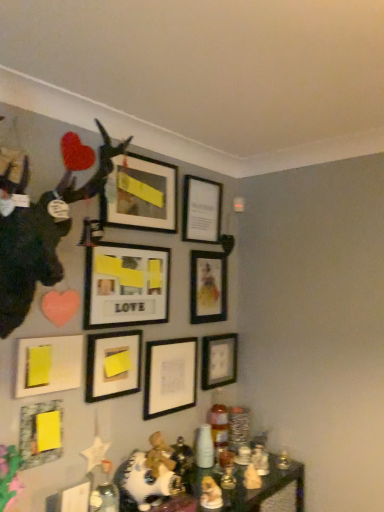
Question: From the image's perspective, would you say yellow matte picture frame at lower left, the first picture frame positioned from the bottom, is shown under matte black picture frame at lower right, positioned as the seventh picture frame in top-to-bottom order?

Choices:
 (A) yes
 (B) no

Answer: (A)

Question: Does yellow matte picture frame at lower left, which ranks as the 9th picture frame in top-to-bottom order, have a lesser width compared to matte black picture frame at lower right, positioned as the seventh picture frame in top-to-bottom order?

Choices:
 (A) yes
 (B) no

Answer: (A)

Question: Is yellow matte picture frame at lower left, which ranks as the 9th picture frame in top-to-bottom order, positioned in front of matte black picture frame at lower right, placed as the 3th picture frame when sorted from bottom to top?

Choices:
 (A) yes
 (B) no

Answer: (A)

Question: From a real-world perspective, is yellow matte picture frame at lower left, which ranks as the 9th picture frame in top-to-bottom order, positioned under matte black picture frame at lower right, placed as the 3th picture frame when sorted from bottom to top, based on gravity?

Choices:
 (A) yes
 (B) no

Answer: (A)

Question: From a real-world perspective, does yellow matte picture frame at lower left, the first picture frame positioned from the bottom, stand above matte black picture frame at lower right, positioned as the seventh picture frame in top-to-bottom order?

Choices:
 (A) yes
 (B) no

Answer: (B)

Question: From a real-world perspective, is matte black picture frame at center, which appears as the eighth picture frame when viewed from the top, above or below shiny glass table at lower center?

Choices:
 (A) below
 (B) above

Answer: (B)

Question: From the image's perspective, is matte black picture frame at center, which is the 2th picture frame from bottom to top, positioned above or below shiny glass table at lower center?

Choices:
 (A) above
 (B) below

Answer: (A)

Question: Do you think matte black picture frame at center, which appears as the eighth picture frame when viewed from the top, is within shiny glass table at lower center, or outside of it?

Choices:
 (A) inside
 (B) outside

Answer: (B)

Question: In the image, is matte black picture frame at center, which appears as the eighth picture frame when viewed from the top, positioned in front of or behind shiny glass table at lower center?

Choices:
 (A) front
 (B) behind

Answer: (B)

Question: Considering the positions of point (208, 309) and point (216, 360), is point (208, 309) closer or farther from the camera than point (216, 360)?

Choices:
 (A) closer
 (B) farther

Answer: (A)

Question: From the image's perspective, is matte black picture frame at center-right, which is the sixth picture frame from bottom to top, above or below matte black picture frame at lower right, placed as the 3th picture frame when sorted from bottom to top?

Choices:
 (A) below
 (B) above

Answer: (B)

Question: In terms of height, does matte black picture frame at center-right, which is the sixth picture frame from bottom to top, look taller or shorter compared to matte black picture frame at lower right, placed as the 3th picture frame when sorted from bottom to top?

Choices:
 (A) short
 (B) tall

Answer: (B)

Question: In the image, is matte black picture frame at center-right, marked as the 4th picture frame in a top-to-bottom arrangement, positioned in front of or behind matte black picture frame at lower right, placed as the 3th picture frame when sorted from bottom to top?

Choices:
 (A) front
 (B) behind

Answer: (A)

Question: Is shiny glass table at lower center in front of or behind matte black picture frame at upper center, which is the ninth picture frame from bottom to top, in the image?

Choices:
 (A) front
 (B) behind

Answer: (A)

Question: Looking at their shapes, would you say shiny glass table at lower center is wider or thinner than matte black picture frame at upper center, which ranks as the 1th picture frame in top-to-bottom order?

Choices:
 (A) wide
 (B) thin

Answer: (A)